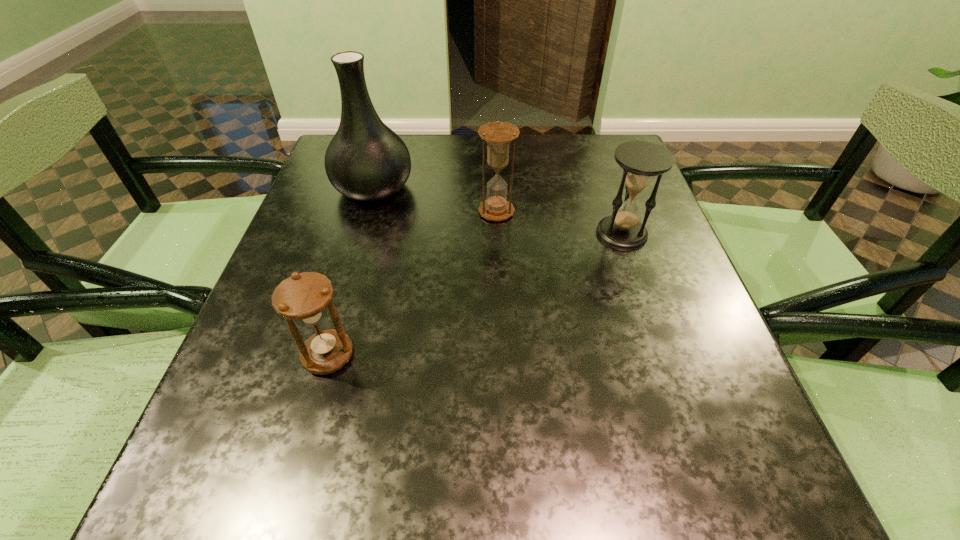
Locate an element on the screen. The height and width of the screenshot is (540, 960). free space between the rightmost hourglass and the leftmost hourglass is located at coordinates pos(475,294).

Identify the location of empty space that is in between the shortest hourglass and the second hourglass from left to right. Image resolution: width=960 pixels, height=540 pixels. (412, 284).

This screenshot has height=540, width=960. Find the location of `free space between the nearest hourglass and the second hourglass from right to left`. free space between the nearest hourglass and the second hourglass from right to left is located at coordinates (412, 284).

At what (x,y) coordinates should I click in order to perform the action: click on free space between the vase and the third object from left to right. Please return your answer as a coordinate pair (x, y). Looking at the image, I should click on (435, 200).

Where is `empty location between the shortest hourglass and the tallest object`? This screenshot has height=540, width=960. empty location between the shortest hourglass and the tallest object is located at coordinates (350, 272).

Where is `free space that is in between the shortest object and the second object from right to left`? The image size is (960, 540). free space that is in between the shortest object and the second object from right to left is located at coordinates (412, 284).

Find the location of a particular element. vacant space in between the nearest object and the rightmost object is located at coordinates (475, 294).

Find the location of a particular element. This screenshot has height=540, width=960. unoccupied area between the vase and the second object from right to left is located at coordinates (x=435, y=200).

Identify which object is located as the third nearest to the rightmost object. Please provide its 2D coordinates. Your answer should be formatted as a tuple, i.e. [(x, y)], where the tuple contains the x and y coordinates of a point satisfying the conditions above.

[(304, 297)]

At what (x,y) coordinates should I click in order to perform the action: click on object that stands as the closest to the shortest object. Please return your answer as a coordinate pair (x, y). Looking at the image, I should click on (366, 161).